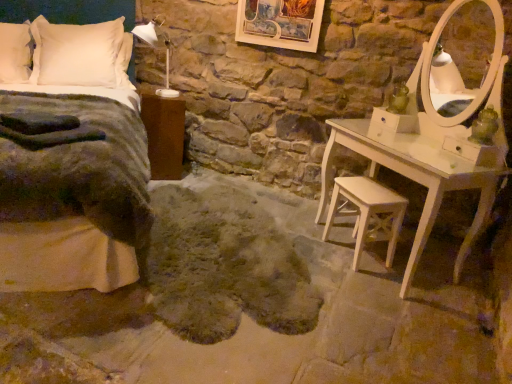
Find the location of a particular element. Image resolution: width=512 pixels, height=384 pixels. empty space that is in between white wood stool at lower right and fuzzy gray rug at center is located at coordinates (331, 261).